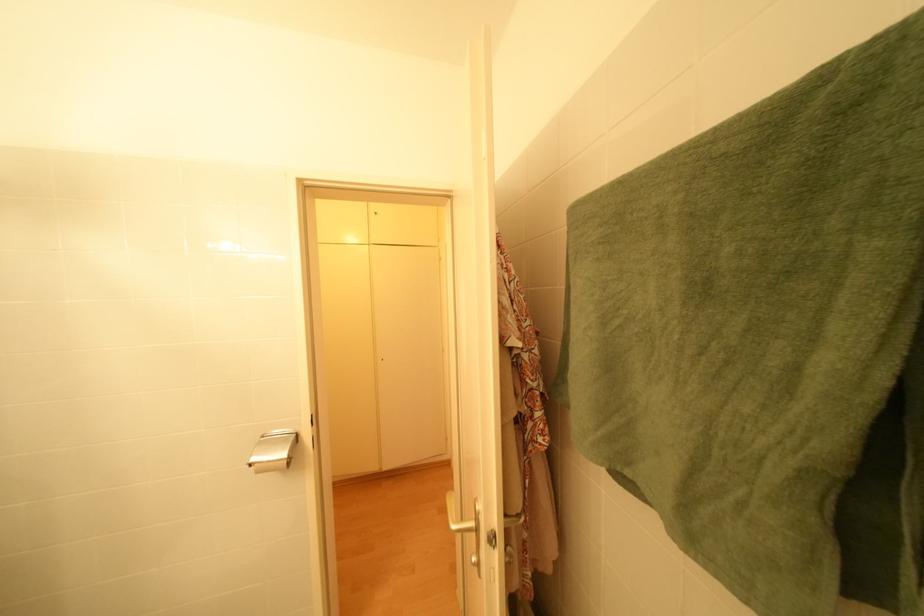
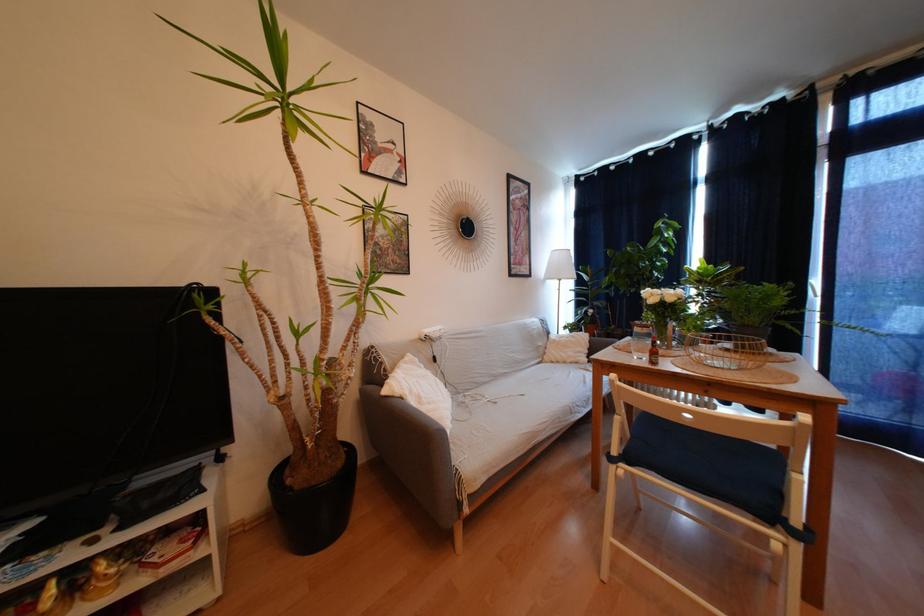
The images are taken continuously from a first-person perspective. In which direction are you moving?

The cameraman moved toward right, forward.